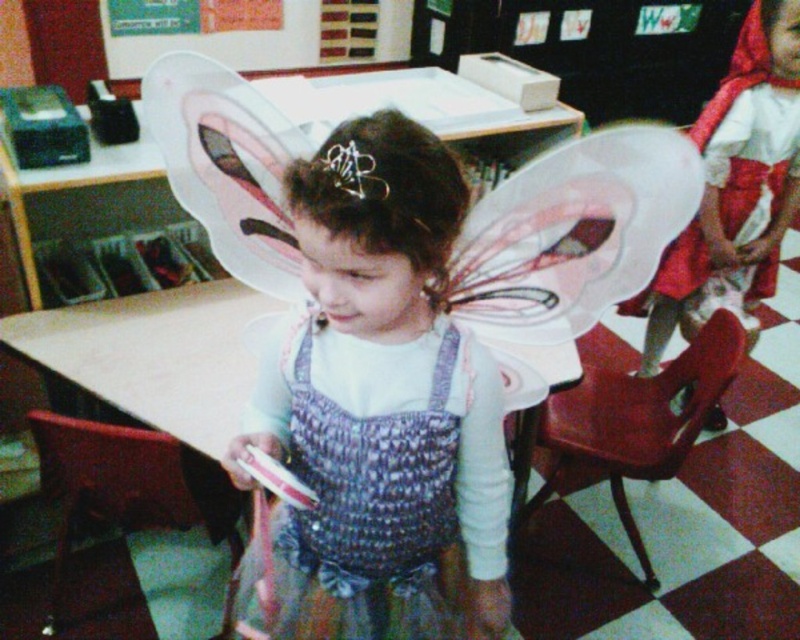
You are an interior designer planning to hang a decorative item exactly at the coordinates where the matte pink wings at center are located. What object is currently occupying that spot?

The matte pink wings at center are currently occupying the coordinates at point [381,413].

You are a photographer setting up for a school play. You need to ensure that the matte pink wings at center and the matte red dress at right are both visible in the shot. Based on their positions, which object is closer to the camera?

The matte pink wings at center is positioned under the matte red dress at right, meaning it is closer to the camera since it appears below and in front of the dress.

You are a photographer setting up for a school play. You need to ensure that the matte pink wings at center and the silver metallic tiara at center are visible in the frame. Given that your camera has a minimum focus distance of 16 inches, will both objects be in focus?

The distance between the matte pink wings at center and the silver metallic tiara at center is 16.41 inches, which exceeds the camera minimum focus distance of 16 inches. Therefore, both objects will be in focus.